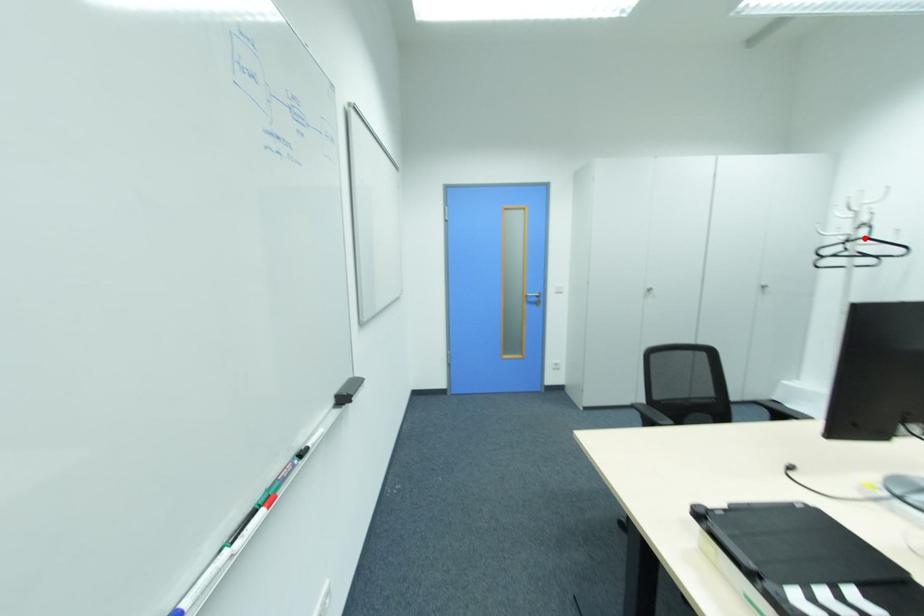
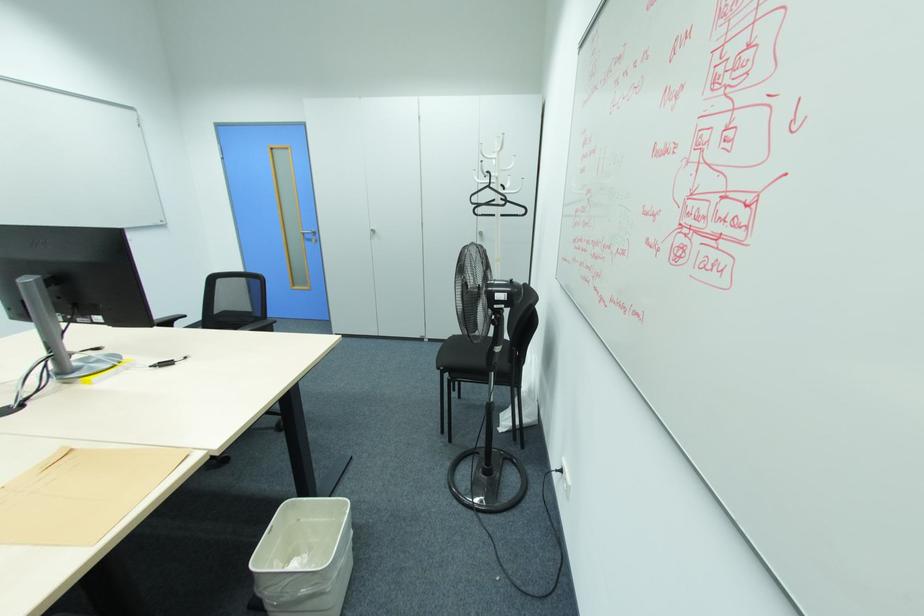
The point at the highlighted location is marked in the first image. Where is the corresponding point in the second image?

(490, 187)